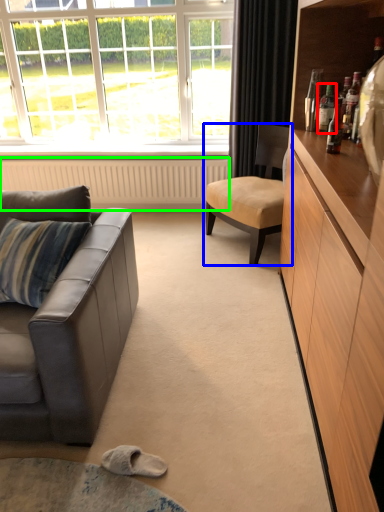
Question: Estimate the real-world distances between objects in this image. Which object is closer to bottle (highlighted by a red box), chair (highlighted by a blue box) or radiator (highlighted by a green box)?

Choices:
 (A) chair
 (B) radiator

Answer: (A)